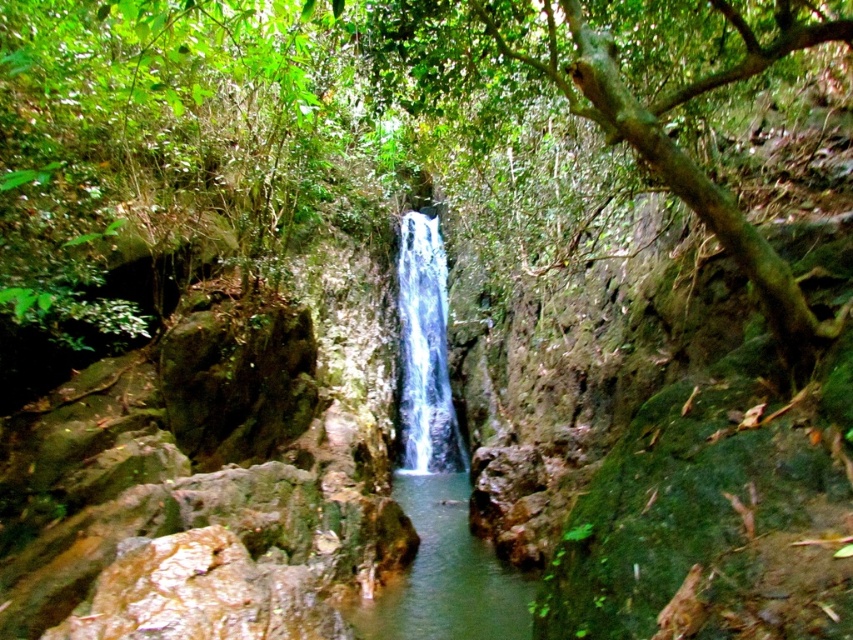
You are standing in front of the waterfall and want to take a photo of both the green leafy tree at center and the clear water at center. Which object should you focus on first to ensure both are in the frame?

You should focus on the green leafy tree at center first because it is in front of the clear water at center, so adjusting the camera to capture the tree will naturally include the water behind it in the frame.

You are standing at the edge of the waterfall and see the green leafy tree at center and the clear water at center. Which object is higher in elevation?

The green leafy tree at center is located above the clear water at center, so it is higher in elevation.

You are standing at point (170, 99) in the scene. What object is located exactly at that point?

The green leafy tree at center is located exactly at point (170, 99).